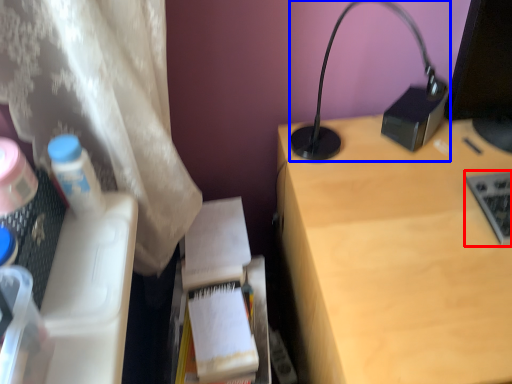
Question: Which of the following is the closest to the observer, laptop keyboard (highlighted by a red box) or lamp (highlighted by a blue box)?

Choices:
 (A) laptop keyboard
 (B) lamp

Answer: (B)